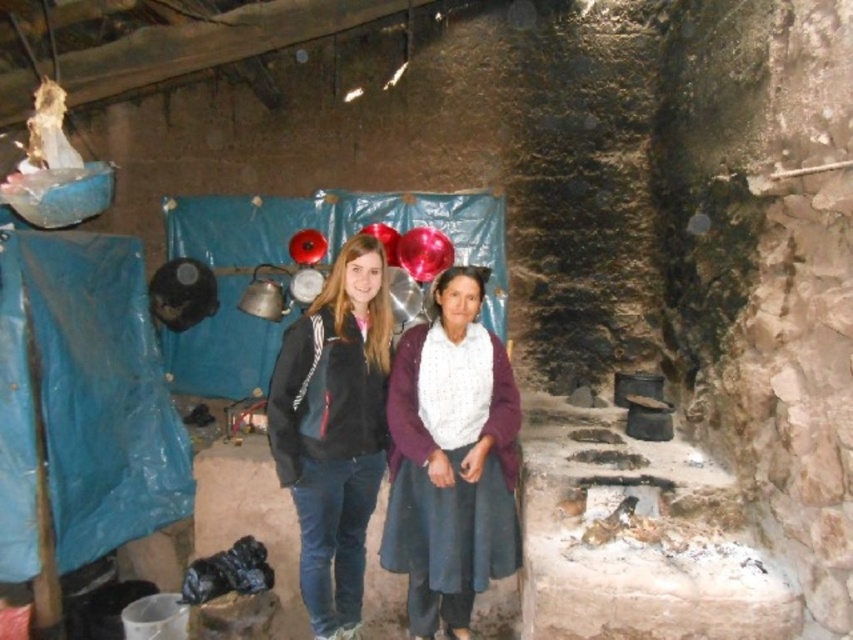
Question: Which point is farther from the camera taking this photo?

Choices:
 (A) (422, 496)
 (B) (343, 250)

Answer: (A)

Question: Where is white knitted sweater at center located in relation to black fleece jacket at center in the image?

Choices:
 (A) right
 (B) left

Answer: (A)

Question: Does white knitted sweater at center lie in front of black fleece jacket at center?

Choices:
 (A) no
 (B) yes

Answer: (B)

Question: Which of the following is the closest to the observer?

Choices:
 (A) (409, 500)
 (B) (383, 275)

Answer: (B)

Question: Which of the following is the farthest from the observer?

Choices:
 (A) (367, 241)
 (B) (392, 376)

Answer: (B)

Question: Can you confirm if white knitted sweater at center is positioned above black fleece jacket at center?

Choices:
 (A) no
 (B) yes

Answer: (A)